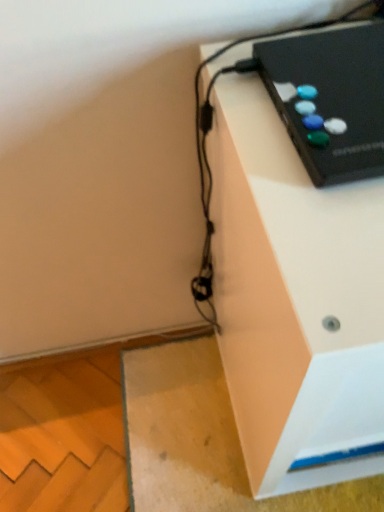
Question: Does black plastic remote control at upper right contain black plastic gamepad at upper right?

Choices:
 (A) yes
 (B) no

Answer: (B)

Question: Does black plastic remote control at upper right have a greater height compared to black plastic gamepad at upper right?

Choices:
 (A) yes
 (B) no

Answer: (A)

Question: Is black plastic remote control at upper right outside black plastic gamepad at upper right?

Choices:
 (A) no
 (B) yes

Answer: (B)

Question: Is black plastic remote control at upper right wider than black plastic gamepad at upper right?

Choices:
 (A) yes
 (B) no

Answer: (A)

Question: Is black plastic remote control at upper right further to camera compared to black plastic gamepad at upper right?

Choices:
 (A) yes
 (B) no

Answer: (B)

Question: Is black plastic remote control at upper right not close to black plastic gamepad at upper right?

Choices:
 (A) yes
 (B) no

Answer: (B)

Question: Considering the relative sizes of black plastic gamepad at upper right and black plastic remote control at upper right in the image provided, is black plastic gamepad at upper right shorter than black plastic remote control at upper right?

Choices:
 (A) no
 (B) yes

Answer: (B)

Question: Is black plastic gamepad at upper right positioned far away from black plastic remote control at upper right?

Choices:
 (A) yes
 (B) no

Answer: (B)

Question: From the image's perspective, is black plastic gamepad at upper right under black plastic remote control at upper right?

Choices:
 (A) no
 (B) yes

Answer: (A)

Question: Considering the relative sizes of black plastic gamepad at upper right and black plastic remote control at upper right in the image provided, is black plastic gamepad at upper right taller than black plastic remote control at upper right?

Choices:
 (A) no
 (B) yes

Answer: (A)

Question: Is the position of black plastic gamepad at upper right less distant than that of black plastic remote control at upper right?

Choices:
 (A) yes
 (B) no

Answer: (B)

Question: Is black plastic gamepad at upper right at the right side of black plastic remote control at upper right?

Choices:
 (A) no
 (B) yes

Answer: (A)

Question: In the image, is black plastic gamepad at upper right positioned in front of or behind black plastic remote control at upper right?

Choices:
 (A) behind
 (B) front

Answer: (A)